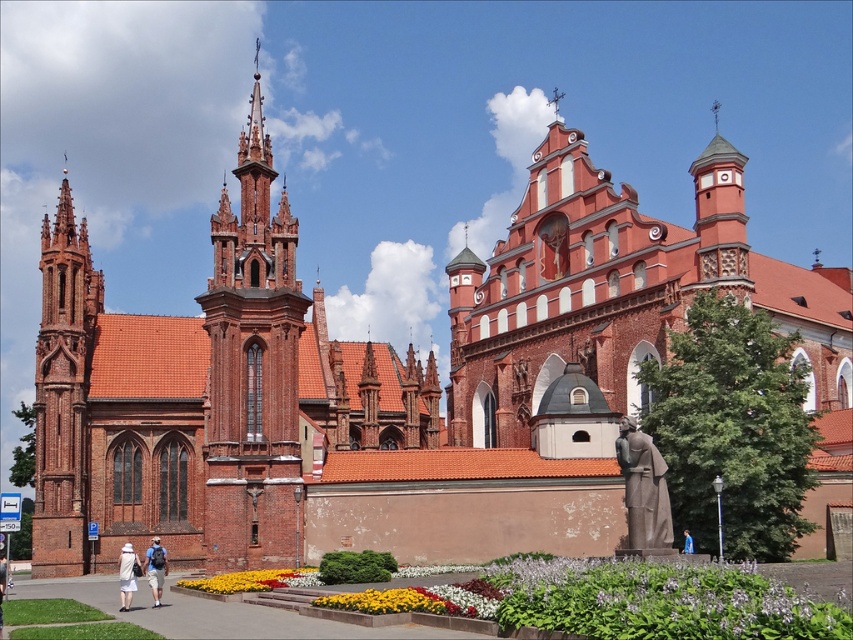
You are standing in a garden and want to take a photo of both the red brick church at center and the yellow matte flowers at center. Which object should you focus on first to ensure both are in the frame?

You should focus on the red brick church at center first since it is closer to you than the yellow matte flowers at center, ensuring both are in the frame.

Based on the photo, you are a photographer standing at the base of the Gothic Revival church on the left. You want to take a photo of the bronze statue at lower right without the yellow matte flowers at center appearing in the frame. Is this possible given their positions?

The bronze statue at lower right is positioned over the yellow matte flowers at center, so if you aim your camera towards the bronze statue at lower right, the flowers will be obscured by it and won